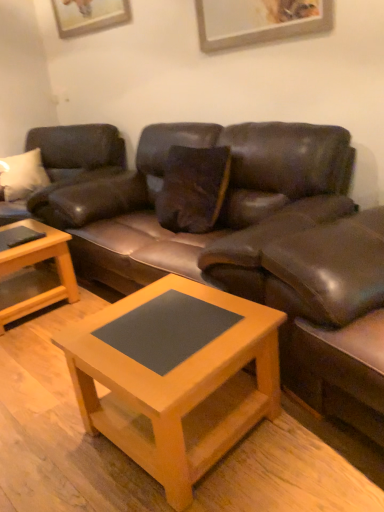
Question: From the image's perspective, relative to matte brown leather couch at left, which ranks as the 1th studio couch in left-to-right order, is leather swivel chair at right above or below?

Choices:
 (A) above
 (B) below

Answer: (B)

Question: From a real-world perspective, relative to matte brown leather couch at left, which ranks as the 1th studio couch in left-to-right order, is leather swivel chair at right vertically above or below?

Choices:
 (A) above
 (B) below

Answer: (B)

Question: Based on their relative distances, which object is nearer to the brown leather couch at center, which appears as the 2th studio couch when viewed from the left?

Choices:
 (A) matte brown leather couch at left, acting as the second studio couch starting from the right
 (B) light brown wooden coffee table at lower left, which appears as the 1th coffee table when viewed from the back
 (C) matte wood coffee table at center, the second coffee table viewed from the left
 (D) leather swivel chair at right
 (E) wooden picture frame at upper center

Answer: (D)

Question: Which object is positioned closest to the matte wood coffee table at center, the second coffee table viewed from the left?

Choices:
 (A) brown leather couch at center, which appears as the 2th studio couch when viewed from the left
 (B) matte brown leather couch at left, acting as the second studio couch starting from the right
 (C) wooden picture frame at upper center
 (D) leather swivel chair at right
 (E) light brown wooden coffee table at lower left, which appears as the 1th coffee table when viewed from the back

Answer: (D)